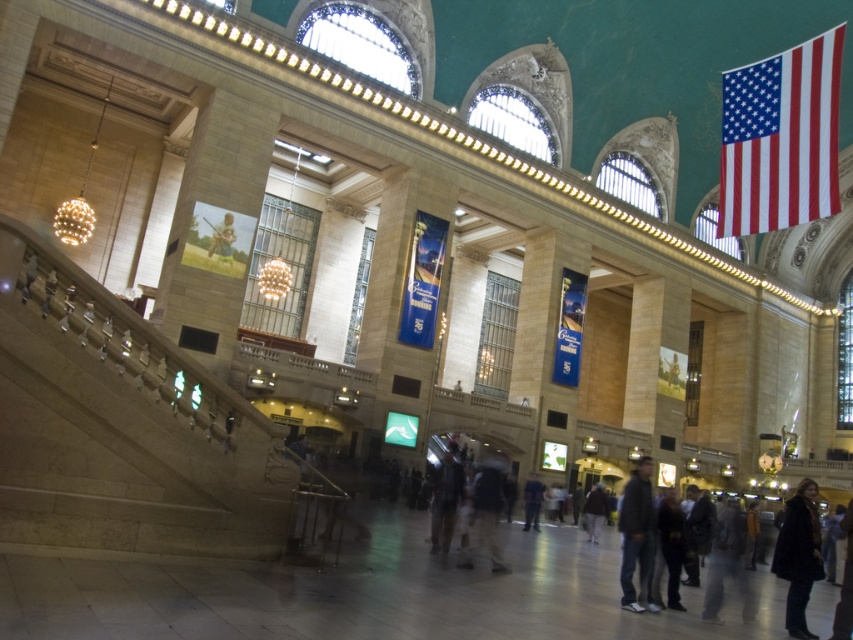
You are a person trying to sit on the light brown wooden chair at center. There is a dark gray pants at lower right nearby. Do you think the chair is wide enough for you to sit without the pants getting in the way?

The dark gray pants at lower right might be wider than light brown wooden chair at center, so there is a possibility that the chair is not wide enough and the pants could obstruct your sitting.

You are standing in the grand historic building and need to sit down. You see the dark gray pants at lower right and the light brown wooden chair at center. Which object is closer to you?

The dark gray pants at lower right is closer to you because it is in front of the light brown wooden chair at center.